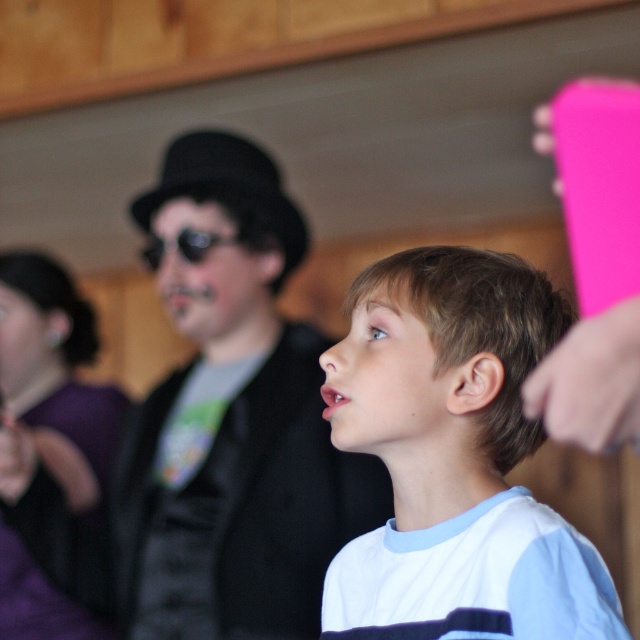
You are a photographer trying to capture the perfect shot of the scene described. You need to focus on the black matte hat at center. Where exactly should you aim your camera to ensure the hat is in the center of the frame?

To center the black matte hat at center in the frame, aim your camera at the coordinates point (232, 422).

You are designing a layout for a magazine cover and need to place two elements based on their sizes. The elements are the white matte shirt at center and the black reflective sunglasses at center from the image. Which element should you choose if you need a larger space for the design?

The white matte shirt at center should be chosen because its width is larger than the black reflective sunglasses at center, making it require more space in the design.

You are a fashion designer observing the image. You need to decide which item would require more fabric to create between the black matte hat at center and the white matte shirt at center. Which one would need more fabric?

The black matte hat at center has a larger size compared to the white matte shirt at center, so it would require more fabric to create.